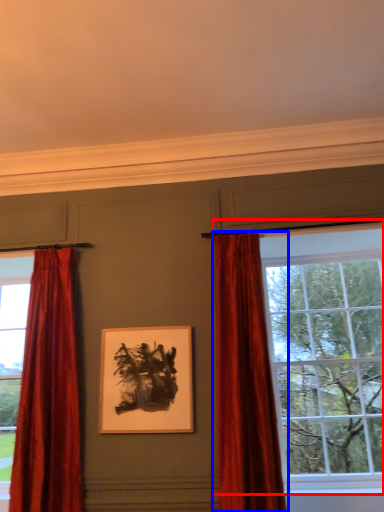
Question: Which object appears farthest to the camera in this image, window (highlighted by a red box) or curtain (highlighted by a blue box)?

Choices:
 (A) window
 (B) curtain

Answer: (A)